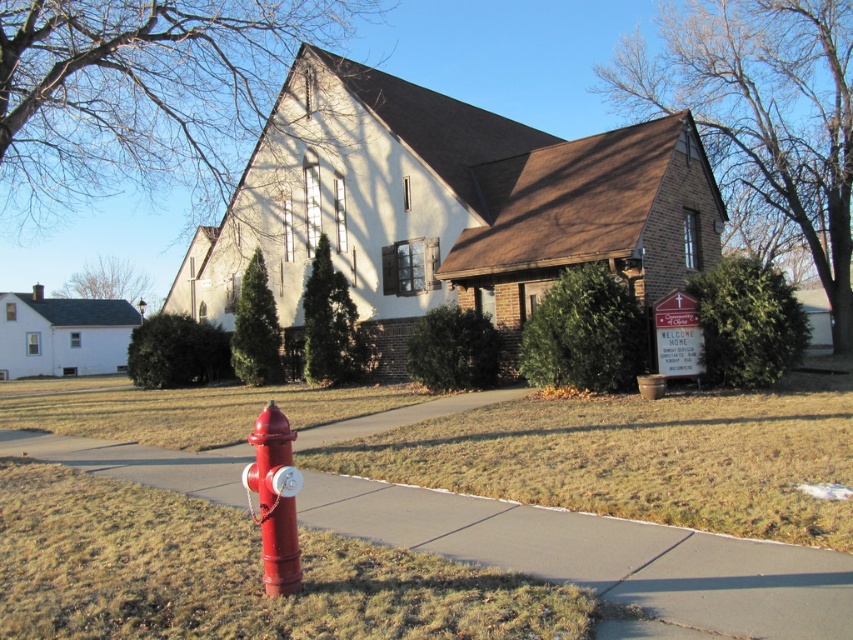
Question: Which point is closer to the camera?

Choices:
 (A) shiny red fire hydrant at lower left
 (B) smooth concrete pavement at lower center

Answer: (B)

Question: Is smooth concrete pavement at lower center to the left of shiny red fire hydrant at lower left from the viewer's perspective?

Choices:
 (A) yes
 (B) no

Answer: (A)

Question: Can you confirm if smooth concrete pavement at lower center is thinner than shiny red fire hydrant at lower left?

Choices:
 (A) yes
 (B) no

Answer: (B)

Question: Does smooth concrete pavement at lower center appear on the left side of shiny red fire hydrant at lower left?

Choices:
 (A) no
 (B) yes

Answer: (B)